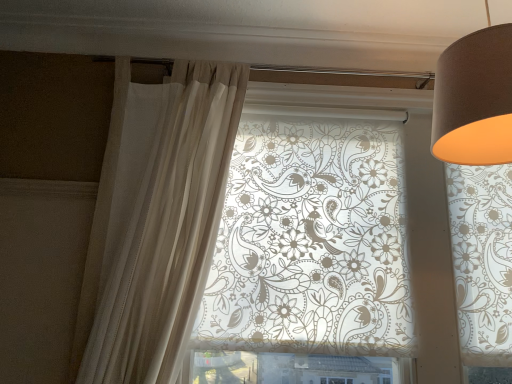
Image resolution: width=512 pixels, height=384 pixels. Describe the element at coordinates (430, 256) in the screenshot. I see `translucent floral-patterned roller blind at center` at that location.

Locate an element on the screen. This screenshot has width=512, height=384. matte brown lampshade at upper right is located at coordinates (474, 99).

Where is `sheer white curtain at left`? This screenshot has width=512, height=384. sheer white curtain at left is located at coordinates (162, 222).

Where is `lamp positioned vertically above the sheer white curtain at left (from a real-world perspective)`? Image resolution: width=512 pixels, height=384 pixels. lamp positioned vertically above the sheer white curtain at left (from a real-world perspective) is located at coordinates (474, 99).

Considering their positions, is matte brown lampshade at upper right located in front of or behind sheer white curtain at left?

matte brown lampshade at upper right is in front of sheer white curtain at left.

Choose the correct answer: Is matte brown lampshade at upper right inside sheer white curtain at left or outside it?

matte brown lampshade at upper right is not inside sheer white curtain at left, it's outside.

From the picture: Can you confirm if matte brown lampshade at upper right is taller than sheer white curtain at left?

No, matte brown lampshade at upper right is not taller than sheer white curtain at left.

What's the angular difference between translucent floral-patterned roller blind at center and sheer white curtain at left's facing directions?

The angle between the facing direction of translucent floral-patterned roller blind at center and the facing direction of sheer white curtain at left is 1.69e-05 degrees.

Find the location of a particular element. window lying behind the sheer white curtain at left is located at coordinates (430, 256).

Is translucent floral-patterned roller blind at center taller or shorter than sheer white curtain at left?

translucent floral-patterned roller blind at center is shorter than sheer white curtain at left.

Which object is further away from the camera, translucent floral-patterned roller blind at center or sheer white curtain at left?

translucent floral-patterned roller blind at center.

Considering the positions of objects translucent floral-patterned roller blind at center and matte brown lampshade at upper right in the image provided, who is more to the right, translucent floral-patterned roller blind at center or matte brown lampshade at upper right?

Positioned to the right is matte brown lampshade at upper right.

Which of these two, translucent floral-patterned roller blind at center or matte brown lampshade at upper right, is bigger?

translucent floral-patterned roller blind at center is bigger.

Does point (451, 278) come closer to viewer compared to point (450, 131)?

No, it is behind (450, 131).

Is translucent floral-patterned roller blind at center wider than matte brown lampshade at upper right?

No.

Who is shorter, sheer white curtain at left or matte brown lampshade at upper right?

Standing shorter between the two is matte brown lampshade at upper right.

Is sheer white curtain at left not near matte brown lampshade at upper right?

No, sheer white curtain at left is not far away from matte brown lampshade at upper right.

Is sheer white curtain at left facing away from matte brown lampshade at upper right?

No.

From a real-world perspective, who is located higher, sheer white curtain at left or matte brown lampshade at upper right?

matte brown lampshade at upper right is physically above.

Is matte brown lampshade at upper right taller or shorter than translucent floral-patterned roller blind at center?

Clearly, matte brown lampshade at upper right is shorter compared to translucent floral-patterned roller blind at center.

Between matte brown lampshade at upper right and translucent floral-patterned roller blind at center, which one has larger size?

translucent floral-patterned roller blind at center is bigger.

How much distance is there between matte brown lampshade at upper right and translucent floral-patterned roller blind at center?

matte brown lampshade at upper right is 23.47 inches away from translucent floral-patterned roller blind at center.

Does sheer white curtain at left have a greater width compared to translucent floral-patterned roller blind at center?

In fact, sheer white curtain at left might be narrower than translucent floral-patterned roller blind at center.

Between sheer white curtain at left and translucent floral-patterned roller blind at center, which one has larger size?

translucent floral-patterned roller blind at center is bigger.

Locate an element on the screen. The height and width of the screenshot is (384, 512). window on the right of sheer white curtain at left is located at coordinates (430, 256).

Which is in front, point (112, 267) or point (456, 337)?

The point (112, 267) is more forward.

Find the location of a particular element. curtain below the matte brown lampshade at upper right (from a real-world perspective) is located at coordinates (162, 222).

Where is `curtain above the translucent floral-patterned roller blind at center (from a real-world perspective)`? This screenshot has width=512, height=384. curtain above the translucent floral-patterned roller blind at center (from a real-world perspective) is located at coordinates (162, 222).

When comparing their distances from sheer white curtain at left, does matte brown lampshade at upper right or translucent floral-patterned roller blind at center seem further?

matte brown lampshade at upper right is positioned further to the anchor sheer white curtain at left.

Estimate the real-world distances between objects in this image. Which object is further from matte brown lampshade at upper right, sheer white curtain at left or translucent floral-patterned roller blind at center?

The object further to matte brown lampshade at upper right is sheer white curtain at left.

Looking at this image, looking at the image, which one is located closer to translucent floral-patterned roller blind at center, matte brown lampshade at upper right or sheer white curtain at left?

sheer white curtain at left is positioned closer to the anchor translucent floral-patterned roller blind at center.

Consider the image. Looking at the image, which one is located further to sheer white curtain at left, translucent floral-patterned roller blind at center or matte brown lampshade at upper right?

Among the two, matte brown lampshade at upper right is located further to sheer white curtain at left.

When comparing their distances from matte brown lampshade at upper right, does translucent floral-patterned roller blind at center or sheer white curtain at left seem further?

sheer white curtain at left.

From the image, which object appears to be nearer to translucent floral-patterned roller blind at center, sheer white curtain at left or matte brown lampshade at upper right?

sheer white curtain at left is closer to translucent floral-patterned roller blind at center.

Where is `window between sheer white curtain at left and matte brown lampshade at upper right`? This screenshot has width=512, height=384. window between sheer white curtain at left and matte brown lampshade at upper right is located at coordinates (430, 256).